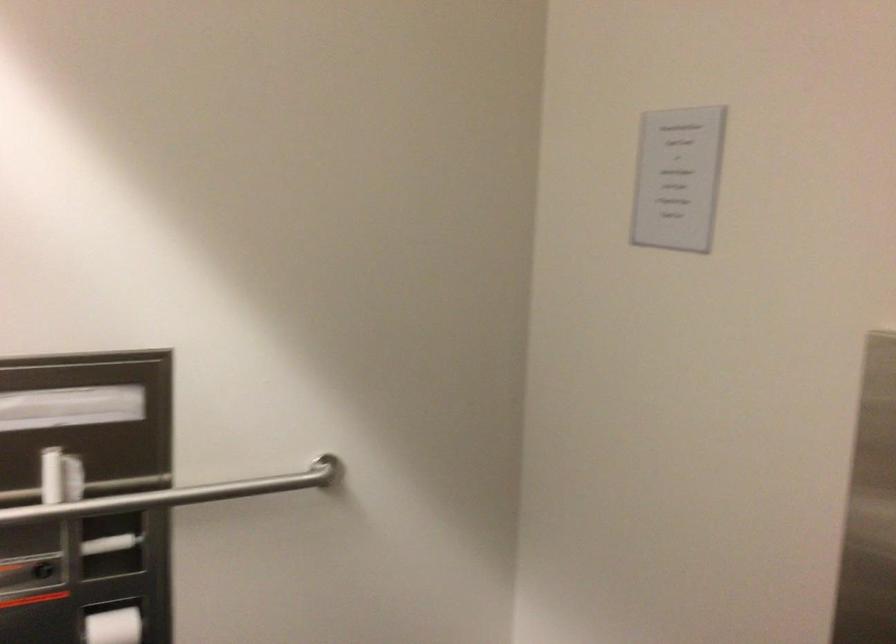
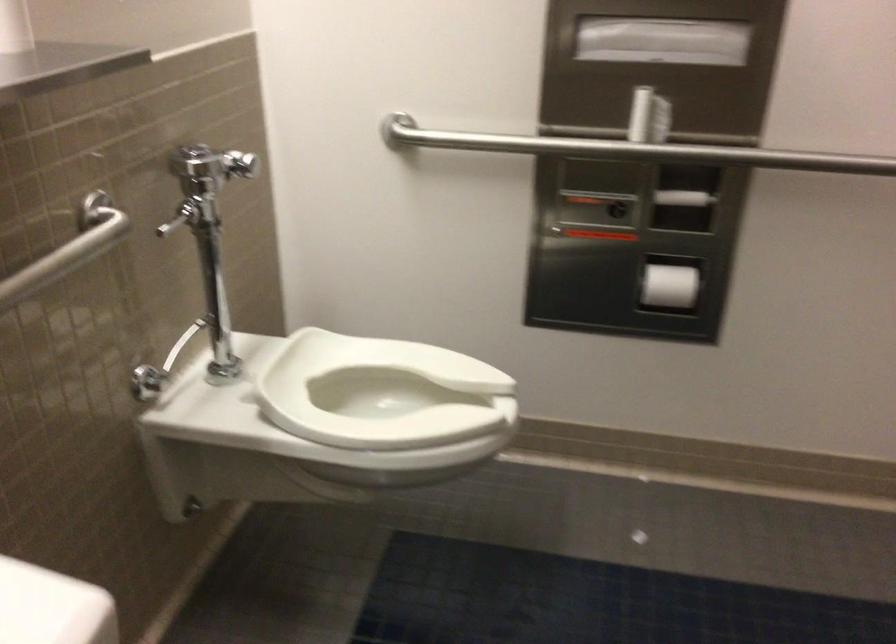
Question: I am providing you with two images of the same scene from different viewpoints. After the viewpoint changes to image2, which objects are now occluded?

Choices:
 (A) chrome flush handle
 (B) white toilet seat
 (C) dispenser turn knob
 (D) none of these

Answer: (D)